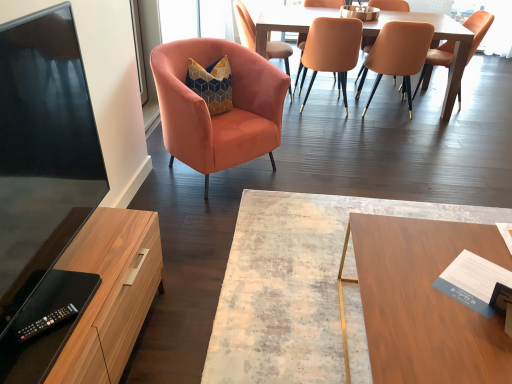
Find the location of a particular element. wooden cabinet at left is located at coordinates (92, 302).

What do you see at coordinates (296, 284) in the screenshot? The image size is (512, 384). I see `wooden rectangular table at center` at bounding box center [296, 284].

The width and height of the screenshot is (512, 384). What do you see at coordinates (245, 25) in the screenshot?
I see `velvet orange chair at upper left, which is counted as the 5th chair, starting from the right` at bounding box center [245, 25].

Describe the element at coordinates (46, 322) in the screenshot. The width and height of the screenshot is (512, 384). I see `black plastic remote control at lower left` at that location.

At what (x,y) coordinates should I click in order to perform the action: click on matte orange chair at upper center, the 2th chair when ordered from right to left. Please return your answer as a coordinate pair (x, y). Image resolution: width=512 pixels, height=384 pixels. Looking at the image, I should click on (397, 55).

Does velvet orange armchair at left, placed as the first chair when sorted from left to right, have a larger size compared to matte black tv at left?

Yes, velvet orange armchair at left, placed as the first chair when sorted from left to right, is bigger than matte black tv at left.

Between velvet orange armchair at left, the sixth chair viewed from the right, and matte black tv at left, which one appears on the right side from the viewer's perspective?

From the viewer's perspective, velvet orange armchair at left, the sixth chair viewed from the right, appears more on the right side.

Which is closer, (242,127) or (2,191)?

Clearly, point (242,127) is more distant from the camera than point (2,191).

Based on the photo, which object is more forward, velvet orange armchair at left, the sixth chair viewed from the right, or matte black tv at left?

matte black tv at left is in front.

From a real-world perspective, is wooden rectangular table at center positioned above or below velvet orange armchair at left, placed as the first chair when sorted from left to right?

wooden rectangular table at center is below velvet orange armchair at left, placed as the first chair when sorted from left to right.

Consider the image. Considering their positions, is wooden rectangular table at center located in front of or behind velvet orange armchair at left, the sixth chair viewed from the right?

Visually, wooden rectangular table at center is located in front of velvet orange armchair at left, the sixth chair viewed from the right.

In the scene shown: Between wooden rectangular table at center and velvet orange armchair at left, placed as the first chair when sorted from left to right, which one appears on the right side from the viewer's perspective?

Positioned to the right is wooden rectangular table at center.

At what (x,y) coordinates should I click in order to perform the action: click on coffee table on the right of velvet orange armchair at left, placed as the first chair when sorted from left to right. Please return your answer as a coordinate pair (x, y). Looking at the image, I should click on (296, 284).

From the picture: Which of these two, matte orange chair at upper right, the 6th chair in the left-to-right sequence, or matte orange chair at center, placed as the 3th chair when sorted from right to left, is thinner?

matte orange chair at center, placed as the 3th chair when sorted from right to left.

From the image's perspective, relative to matte orange chair at center, arranged as the 4th chair when viewed from the left, is matte orange chair at upper right, the 6th chair in the left-to-right sequence, above or below?

Based on their image positions, matte orange chair at upper right, the 6th chair in the left-to-right sequence, is located above matte orange chair at center, arranged as the 4th chair when viewed from the left.

How much distance is there between matte orange chair at upper right, positioned as the 1th chair in right-to-left order, and matte orange chair at center, placed as the 3th chair when sorted from right to left?

3.43 feet.

Could you tell me if matte orange chair at upper right, positioned as the 1th chair in right-to-left order, is facing matte orange chair at center, placed as the 3th chair when sorted from right to left?

Yes.

From a real-world perspective, is black plastic remote control at lower left physically above light brown wooden table at center?

Yes, from a real-world perspective, black plastic remote control at lower left is above light brown wooden table at center.

Can you tell me how much black plastic remote control at lower left and light brown wooden table at center differ in facing direction?

The angular difference between black plastic remote control at lower left and light brown wooden table at center is 143 degrees.

Where is `remote control to the left of light brown wooden table at center`? The width and height of the screenshot is (512, 384). remote control to the left of light brown wooden table at center is located at coordinates pos(46,322).

Considering the sizes of matte black tv at left and wooden desk at center in the image, is matte black tv at left bigger or smaller than wooden desk at center?

matte black tv at left is smaller than wooden desk at center.

Are matte black tv at left and wooden desk at center making contact?

They are not placed beside each other.

Can you confirm if matte black tv at left is shorter than wooden desk at center?

No, matte black tv at left is not shorter than wooden desk at center.

Is point (31, 266) behind point (369, 280)?

No.

From a real-world perspective, is matte orange chair at center, placed as the 3th chair when sorted from right to left, over matte black tv at left?

No, from a real-world perspective, matte orange chair at center, placed as the 3th chair when sorted from right to left, is not on top of matte black tv at left.

Does matte orange chair at center, arranged as the 4th chair when viewed from the left, have a smaller size compared to matte black tv at left?

Actually, matte orange chair at center, arranged as the 4th chair when viewed from the left, might be larger than matte black tv at left.

Can matte black tv at left be found inside matte orange chair at center, placed as the 3th chair when sorted from right to left?

Actually, matte black tv at left is outside matte orange chair at center, placed as the 3th chair when sorted from right to left.

Can you tell me how much matte orange chair at center, arranged as the 4th chair when viewed from the left, and matte black tv at left differ in facing direction?

The angular difference between matte orange chair at center, arranged as the 4th chair when viewed from the left, and matte black tv at left is 90 degrees.

From their relative heights in the image, would you say light brown wooden table at center is taller or shorter than black plastic remote control at lower left?

In the image, light brown wooden table at center appears to be taller than black plastic remote control at lower left.

Is light brown wooden table at center positioned far away from black plastic remote control at lower left?

→ That's right, there is a large distance between light brown wooden table at center and black plastic remote control at lower left.

Is the position of light brown wooden table at center more distant than that of black plastic remote control at lower left?

Yes, light brown wooden table at center is behind black plastic remote control at lower left.

Is light brown wooden table at center positioned with its back to black plastic remote control at lower left?

light brown wooden table at center is not turned away from black plastic remote control at lower left.

At what (x,y) coordinates should I click in order to perform the action: click on television below the velvet orange armchair at left, the sixth chair viewed from the right (from the image's perspective). Please return your answer as a coordinate pair (x, y). The image size is (512, 384). Looking at the image, I should click on (42, 179).

Locate an element on the screen. coffee table on the right of velvet orange armchair at left, the sixth chair viewed from the right is located at coordinates (296, 284).

Which object lies nearer to the anchor point matte orange chair at upper center, which is the 3th chair from left to right, wooden desk at center or velvet orange chair at upper left, which is counted as the 5th chair, starting from the right?

velvet orange chair at upper left, which is counted as the 5th chair, starting from the right, is closer to matte orange chair at upper center, which is the 3th chair from left to right.

Looking at the image, which one is located closer to wooden cabinet at left, matte orange chair at center, arranged as the 4th chair when viewed from the left, or wooden rectangular table at center?

wooden rectangular table at center.

When comparing their distances from light brown wooden table at center, does matte orange chair at center, arranged as the 4th chair when viewed from the left, or black plastic remote control at lower left seem closer?

matte orange chair at center, arranged as the 4th chair when viewed from the left, is positioned closer to the anchor light brown wooden table at center.

From the picture: Looking at the image, which one is located closer to matte orange chair at upper center, the 4th chair from the right, matte black tv at left or velvet orange armchair at left, the sixth chair viewed from the right?

velvet orange armchair at left, the sixth chair viewed from the right, is positioned closer to the anchor matte orange chair at upper center, the 4th chair from the right.

Considering their positions, is matte orange chair at upper right, the 6th chair in the left-to-right sequence, positioned further to wooden rectangular table at center than wooden desk at center?

matte orange chair at upper right, the 6th chair in the left-to-right sequence, lies further to wooden rectangular table at center than the other object.

From the image, which object appears to be farther from black plastic remote control at lower left, velvet orange chair at upper left, which is counted as the 5th chair, starting from the right, or light brown wooden table at center?

Based on the image, light brown wooden table at center appears to be further to black plastic remote control at lower left.

Based on their spatial positions, is velvet orange armchair at left, the sixth chair viewed from the right, or matte orange chair at upper center, which appears as the fifth chair when viewed from the left, closer to matte orange chair at center, arranged as the 4th chair when viewed from the left?

Among the two, matte orange chair at upper center, which appears as the fifth chair when viewed from the left, is located nearer to matte orange chair at center, arranged as the 4th chair when viewed from the left.

Which object lies nearer to the anchor point light brown wooden table at center, wooden desk at center or matte orange chair at upper center, which is the 3th chair from left to right?

Based on the image, matte orange chair at upper center, which is the 3th chair from left to right, appears to be nearer to light brown wooden table at center.

Locate an element on the screen. The image size is (512, 384). remote control between wooden cabinet at left and velvet orange armchair at left, placed as the first chair when sorted from left to right, in the front-back direction is located at coordinates (46, 322).

This screenshot has height=384, width=512. I want to click on remote control between wooden cabinet at left and matte orange chair at upper center, the 4th chair from the right, in the front-back direction, so click(x=46, y=322).

Where is `coffee table between wooden cabinet at left and matte orange chair at center, arranged as the 4th chair when viewed from the left, along the z-axis`? This screenshot has height=384, width=512. coffee table between wooden cabinet at left and matte orange chair at center, arranged as the 4th chair when viewed from the left, along the z-axis is located at coordinates (296, 284).

Find the location of a particular element. This screenshot has width=512, height=384. desk between wooden cabinet at left and matte orange chair at upper center, which is the 3th chair from left to right, from front to back is located at coordinates (423, 302).